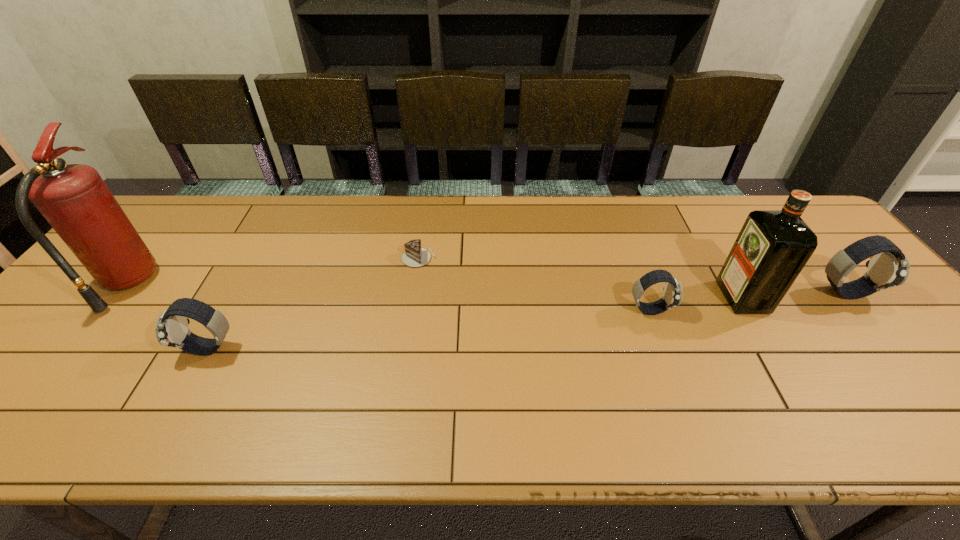
Identify the location of free point between the liquor and the fourth object from left to right. This screenshot has width=960, height=540. (696, 303).

This screenshot has width=960, height=540. I want to click on free spot between the rightmost watch and the second shortest watch, so click(x=526, y=320).

Identify the location of unoccupied position between the fifth object from left to right and the fourth object from right to left. This screenshot has height=540, width=960. (581, 278).

Where is `empty space between the leftmost watch and the fourth object from right to left`? empty space between the leftmost watch and the fourth object from right to left is located at coordinates (313, 303).

The width and height of the screenshot is (960, 540). What are the coordinates of `empty space between the rightmost object and the fire extinguisher` in the screenshot? It's located at (486, 287).

Locate an element on the screen. The image size is (960, 540). vacant area between the fire extinguisher and the rightmost object is located at coordinates 486,287.

Find the location of a particular element. Image resolution: width=960 pixels, height=540 pixels. vacant region between the fire extinguisher and the rightmost object is located at coordinates coord(486,287).

Locate which object ranks fifth in proximity to the shortest watch. Please provide its 2D coordinates. Your answer should be formatted as a tuple, i.e. [(x, y)], where the tuple contains the x and y coordinates of a point satisfying the conditions above.

[(74, 199)]

Choose which object is the nearest neighbor to the rightmost watch. Please provide its 2D coordinates. Your answer should be formatted as a tuple, i.e. [(x, y)], where the tuple contains the x and y coordinates of a point satisfying the conditions above.

[(773, 246)]

Find the location of a particular element. watch that stands as the third closest to the leftmost object is located at coordinates (888, 267).